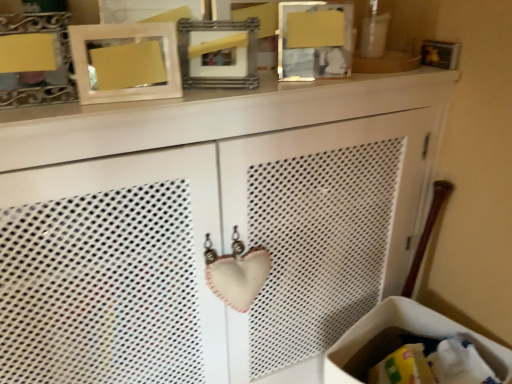
Identify the location of metallic silver picture frame at upper center, acting as the second picture frame starting from the right. This screenshot has width=512, height=384. (215, 60).

Locate an element on the screen. The image size is (512, 384). wooden picture frame at upper center, the 1th picture frame positioned from the right is located at coordinates (314, 40).

I want to click on white fabric laundry basket at lower right, so click(400, 341).

Describe the element at coordinates (126, 62) in the screenshot. The width and height of the screenshot is (512, 384). I see `matte white picture frame at upper center, marked as the 3th picture frame in a right-to-left arrangement` at that location.

You are a GUI agent. You are given a task and a screenshot of the screen. Output one action in this format:
    pyautogui.click(x=<x>, y=<y>)
    Task: Click on the metallic silver picture frame at upper center, placed as the third picture frame when sorted from left to right
    This screenshot has height=384, width=512.
    Given the screenshot: What is the action you would take?
    pyautogui.click(x=215, y=60)

Is white fabric laundry basket at lower right wider or thinner than matte white picture frame at upper center, marked as the 3th picture frame in a right-to-left arrangement?

Considering their sizes, white fabric laundry basket at lower right looks broader than matte white picture frame at upper center, marked as the 3th picture frame in a right-to-left arrangement.

From a real-world perspective, who is located lower, white fabric laundry basket at lower right or matte white picture frame at upper center, the second picture frame positioned from the left?

white fabric laundry basket at lower right.

From the image's perspective, is white fabric laundry basket at lower right beneath matte white picture frame at upper center, the second picture frame positioned from the left?

Correct, white fabric laundry basket at lower right appears lower than matte white picture frame at upper center, the second picture frame positioned from the left, in the image.

Is the position of white fabric laundry basket at lower right more distant than that of matte white picture frame at upper center, marked as the 3th picture frame in a right-to-left arrangement?

Yes, white fabric laundry basket at lower right is further from the viewer.

Would you say matte silver picture frame at upper left, the first picture frame from the left, is part of metallic silver picture frame at upper center, acting as the second picture frame starting from the right,'s contents?

No, matte silver picture frame at upper left, the first picture frame from the left, is not inside metallic silver picture frame at upper center, acting as the second picture frame starting from the right.

From a real-world perspective, who is located lower, metallic silver picture frame at upper center, placed as the third picture frame when sorted from left to right, or matte silver picture frame at upper left, the first picture frame from the left?

metallic silver picture frame at upper center, placed as the third picture frame when sorted from left to right, is physically lower.

Who is more distant, metallic silver picture frame at upper center, acting as the second picture frame starting from the right, or matte silver picture frame at upper left, the first picture frame from the left?

metallic silver picture frame at upper center, acting as the second picture frame starting from the right.

How different are the orientations of metallic silver picture frame at upper center, placed as the third picture frame when sorted from left to right, and matte silver picture frame at upper left, the first picture frame from the left, in degrees?

26.4 degrees separate the facing orientations of metallic silver picture frame at upper center, placed as the third picture frame when sorted from left to right, and matte silver picture frame at upper left, the first picture frame from the left.

How many degrees apart are the facing directions of metallic silver picture frame at upper center, placed as the third picture frame when sorted from left to right, and white fabric laundry basket at lower right?

38.4 degrees separate the facing orientations of metallic silver picture frame at upper center, placed as the third picture frame when sorted from left to right, and white fabric laundry basket at lower right.

Is the depth of metallic silver picture frame at upper center, placed as the third picture frame when sorted from left to right, greater than that of white fabric laundry basket at lower right?

Yes, it is.

Between metallic silver picture frame at upper center, acting as the second picture frame starting from the right, and white fabric laundry basket at lower right, which one has smaller width?

metallic silver picture frame at upper center, acting as the second picture frame starting from the right, is thinner.

This screenshot has height=384, width=512. In order to click on laundry basket located below the metallic silver picture frame at upper center, acting as the second picture frame starting from the right (from the image's perspective) in this screenshot , I will do pyautogui.click(x=400, y=341).

Does point (320, 15) lie behind point (180, 34)?

Yes, point (320, 15) is behind point (180, 34).

Considering the relative sizes of wooden picture frame at upper center, the 1th picture frame positioned from the right, and metallic silver picture frame at upper center, acting as the second picture frame starting from the right, in the image provided, is wooden picture frame at upper center, the 1th picture frame positioned from the right, thinner than metallic silver picture frame at upper center, acting as the second picture frame starting from the right,?

Correct, the width of wooden picture frame at upper center, the 1th picture frame positioned from the right, is less than that of metallic silver picture frame at upper center, acting as the second picture frame starting from the right.

Is wooden picture frame at upper center, the 1th picture frame positioned from the right, turned away from metallic silver picture frame at upper center, placed as the third picture frame when sorted from left to right?

No.

From a real-world perspective, which object stands above the other?

wooden picture frame at upper center, the 1th picture frame positioned from the right, from a real-world perspective.

From the image's perspective, is wooden picture frame at upper center, the 1th picture frame positioned from the right, on top of matte white picture frame at upper center, the second picture frame positioned from the left?

Yes, from the image's perspective, wooden picture frame at upper center, the 1th picture frame positioned from the right, is over matte white picture frame at upper center, the second picture frame positioned from the left.

From a real-world perspective, is wooden picture frame at upper center, the 1th picture frame positioned from the right, positioned above or below matte white picture frame at upper center, the second picture frame positioned from the left?

Clearly, from a real-world perspective, wooden picture frame at upper center, the 1th picture frame positioned from the right, is above matte white picture frame at upper center, the second picture frame positioned from the left.

Considering the relative positions of wooden picture frame at upper center, the 1th picture frame positioned from the right, and matte white picture frame at upper center, the second picture frame positioned from the left, in the image provided, is wooden picture frame at upper center, the 1th picture frame positioned from the right, to the right of matte white picture frame at upper center, the second picture frame positioned from the left, from the viewer's perspective?

Correct, you'll find wooden picture frame at upper center, the 1th picture frame positioned from the right, to the right of matte white picture frame at upper center, the second picture frame positioned from the left.

Is metallic silver picture frame at upper center, placed as the third picture frame when sorted from left to right, positioned beyond the bounds of wooden picture frame at upper center, which is the fourth picture frame from left to right?

Indeed, metallic silver picture frame at upper center, placed as the third picture frame when sorted from left to right, is completely outside wooden picture frame at upper center, which is the fourth picture frame from left to right.

Is metallic silver picture frame at upper center, acting as the second picture frame starting from the right, looking in the opposite direction of wooden picture frame at upper center, which is the fourth picture frame from left to right?

No, metallic silver picture frame at upper center, acting as the second picture frame starting from the right, is not facing away from wooden picture frame at upper center, which is the fourth picture frame from left to right.

Is metallic silver picture frame at upper center, acting as the second picture frame starting from the right, far from wooden picture frame at upper center, which is the fourth picture frame from left to right?

metallic silver picture frame at upper center, acting as the second picture frame starting from the right, is actually quite close to wooden picture frame at upper center, which is the fourth picture frame from left to right.

From a real-world perspective, who is located higher, white fabric laundry basket at lower right or metallic silver picture frame at upper center, acting as the second picture frame starting from the right?

From a 3D spatial view, metallic silver picture frame at upper center, acting as the second picture frame starting from the right, is above.

Can you confirm if white fabric laundry basket at lower right is thinner than metallic silver picture frame at upper center, acting as the second picture frame starting from the right?

No, white fabric laundry basket at lower right is not thinner than metallic silver picture frame at upper center, acting as the second picture frame starting from the right.

From their relative heights in the image, would you say white fabric laundry basket at lower right is taller or shorter than metallic silver picture frame at upper center, acting as the second picture frame starting from the right?

white fabric laundry basket at lower right is taller than metallic silver picture frame at upper center, acting as the second picture frame starting from the right.

The height and width of the screenshot is (384, 512). Identify the location of laundry basket that appears below the metallic silver picture frame at upper center, acting as the second picture frame starting from the right (from a real-world perspective). (400, 341).

The height and width of the screenshot is (384, 512). In order to click on laundry basket that is below the matte white picture frame at upper center, the second picture frame positioned from the left (from the image's perspective) in this screenshot , I will do `click(400, 341)`.

Which picture frame is the 2nd one when counting from the front of the metallic silver picture frame at upper center, acting as the second picture frame starting from the right? Please provide its 2D coordinates.

[(39, 72)]

From the image, which object appears to be farther from matte silver picture frame at upper left, acting as the 4th picture frame starting from the right, metallic silver picture frame at upper center, acting as the second picture frame starting from the right, or matte white picture frame at upper center, the second picture frame positioned from the left?

metallic silver picture frame at upper center, acting as the second picture frame starting from the right.

Which object lies nearer to the anchor point metallic silver picture frame at upper center, acting as the second picture frame starting from the right, matte white picture frame at upper center, the second picture frame positioned from the left, or matte silver picture frame at upper left, the first picture frame from the left?

matte white picture frame at upper center, the second picture frame positioned from the left, is closer to metallic silver picture frame at upper center, acting as the second picture frame starting from the right.

Considering their positions, is metallic silver picture frame at upper center, acting as the second picture frame starting from the right, positioned further to matte white picture frame at upper center, marked as the 3th picture frame in a right-to-left arrangement, than white fabric laundry basket at lower right?

white fabric laundry basket at lower right is positioned further to the anchor matte white picture frame at upper center, marked as the 3th picture frame in a right-to-left arrangement.

From the image, which object appears to be nearer to wooden picture frame at upper center, the 1th picture frame positioned from the right, matte silver picture frame at upper left, acting as the 4th picture frame starting from the right, or metallic silver picture frame at upper center, acting as the second picture frame starting from the right?

Based on the image, metallic silver picture frame at upper center, acting as the second picture frame starting from the right, appears to be nearer to wooden picture frame at upper center, the 1th picture frame positioned from the right.

Based on the photo, estimate the real-world distances between objects in this image. Which object is closer to metallic silver picture frame at upper center, acting as the second picture frame starting from the right, wooden picture frame at upper center, which is the fourth picture frame from left to right, or matte silver picture frame at upper left, acting as the 4th picture frame starting from the right?

Based on the image, wooden picture frame at upper center, which is the fourth picture frame from left to right, appears to be nearer to metallic silver picture frame at upper center, acting as the second picture frame starting from the right.

Based on the photo, estimate the real-world distances between objects in this image. Which object is closer to matte silver picture frame at upper left, acting as the 4th picture frame starting from the right, white fabric laundry basket at lower right or metallic silver picture frame at upper center, placed as the third picture frame when sorted from left to right?

metallic silver picture frame at upper center, placed as the third picture frame when sorted from left to right.

When comparing their distances from metallic silver picture frame at upper center, placed as the third picture frame when sorted from left to right, does white fabric laundry basket at lower right or matte white picture frame at upper center, marked as the 3th picture frame in a right-to-left arrangement, seem further?

Based on the image, white fabric laundry basket at lower right appears to be further to metallic silver picture frame at upper center, placed as the third picture frame when sorted from left to right.

When comparing their distances from matte silver picture frame at upper left, acting as the 4th picture frame starting from the right, does wooden picture frame at upper center, the 1th picture frame positioned from the right, or matte white picture frame at upper center, the second picture frame positioned from the left, seem further?

wooden picture frame at upper center, the 1th picture frame positioned from the right.

The height and width of the screenshot is (384, 512). Find the location of `picture frame between matte silver picture frame at upper left, acting as the 4th picture frame starting from the right, and white fabric laundry basket at lower right from top to bottom`. picture frame between matte silver picture frame at upper left, acting as the 4th picture frame starting from the right, and white fabric laundry basket at lower right from top to bottom is located at coordinates (126, 62).

What are the coordinates of `picture frame located between matte silver picture frame at upper left, acting as the 4th picture frame starting from the right, and metallic silver picture frame at upper center, acting as the second picture frame starting from the right, in the left-right direction` in the screenshot? It's located at (126, 62).

Locate an element on the screen. picture frame between matte white picture frame at upper center, the second picture frame positioned from the left, and wooden picture frame at upper center, the 1th picture frame positioned from the right, in the horizontal direction is located at coordinates (215, 60).